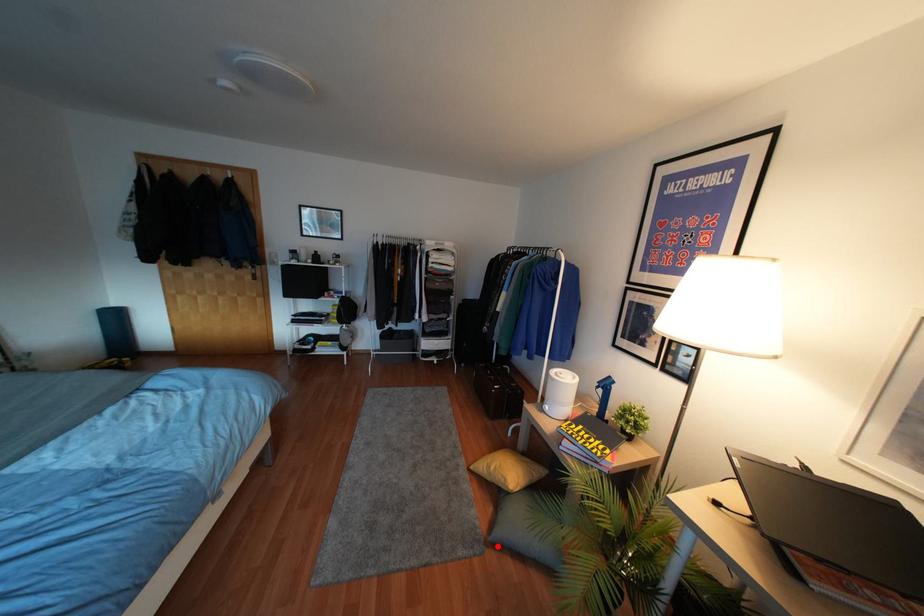
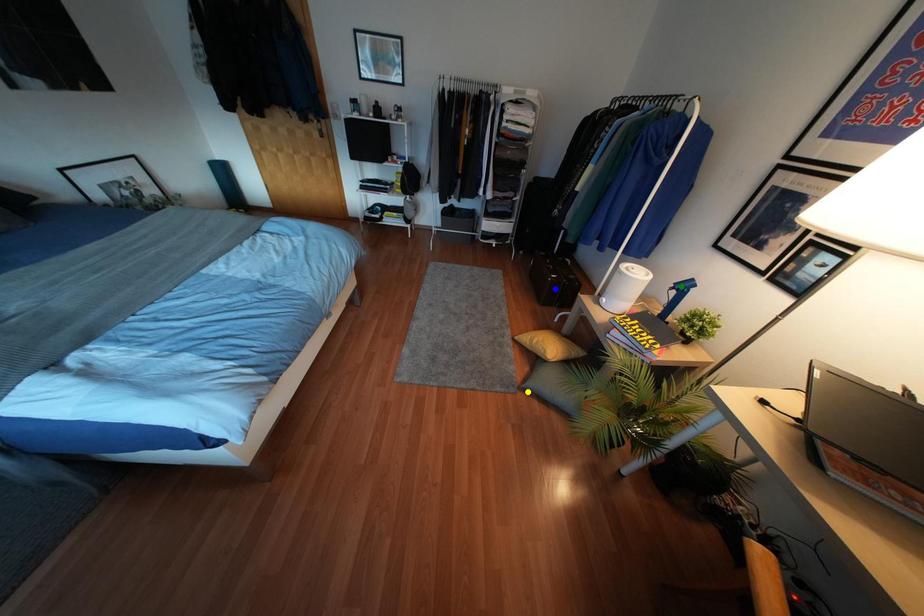
Question: I am providing you with two images of the same scene from different viewpoints. A red point is marked on the first image. You are given multiple points on the second image. In image 2, which mark is for the same physical point as the one in image 1?

Choices:
 (A) yellow point
 (B) blue point
 (C) green point

Answer: (A)